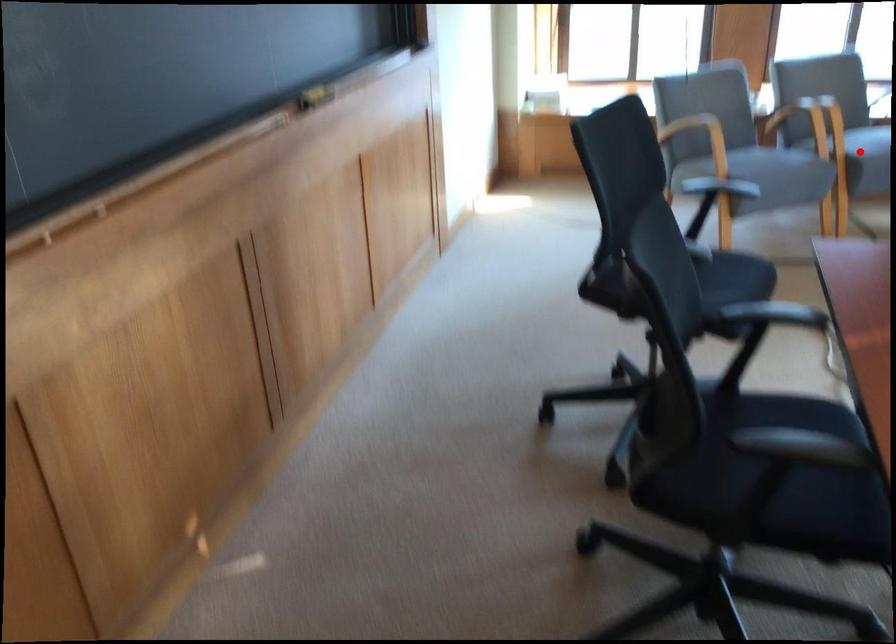
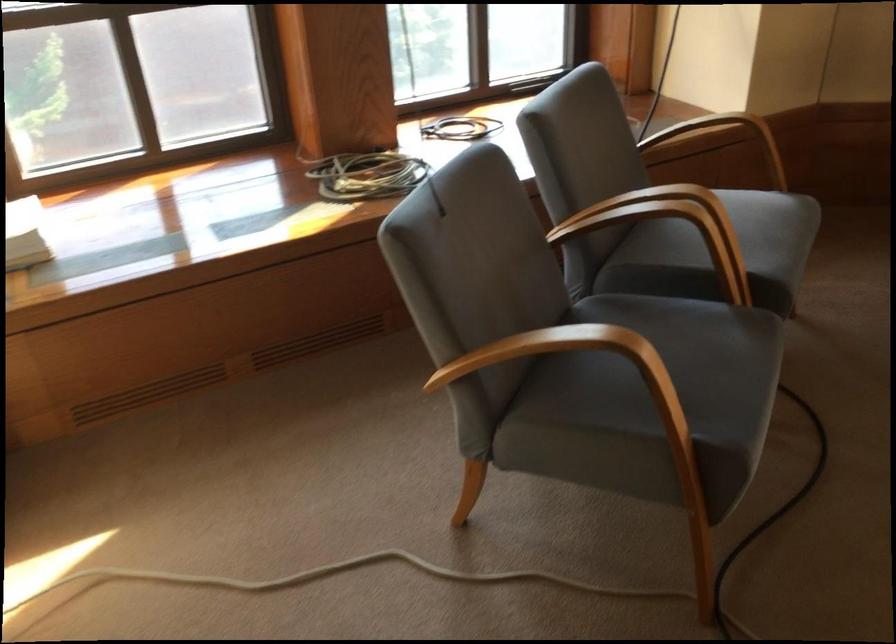
Question: I am providing you with two images of the same scene from different viewpoints. A red point is marked on the first image. Is the red point's position out of view in image 2?

Choices:
 (A) Yes
 (B) No

Answer: (A)